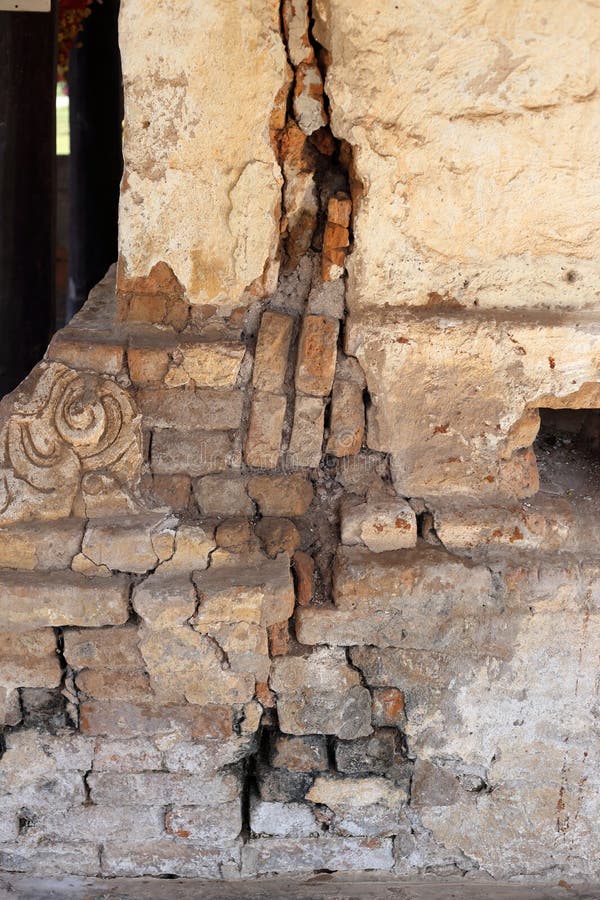
Locate an element on the screen. crack in wall is located at coordinates (208, 556).